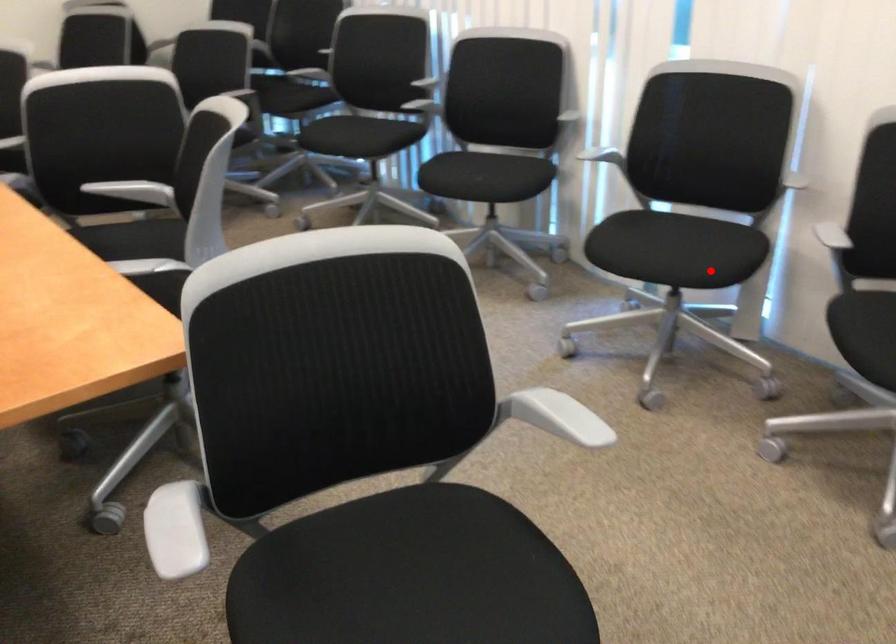
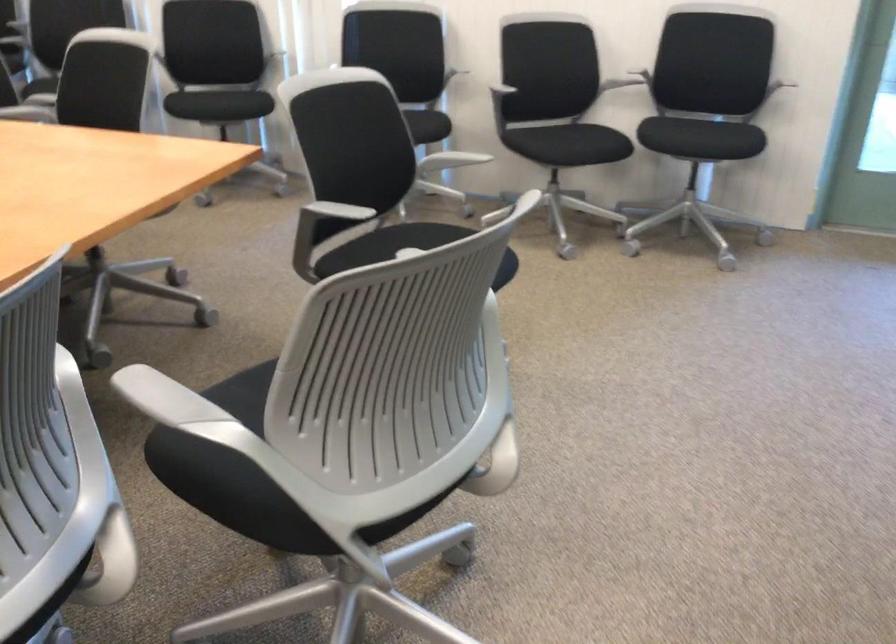
Find the pixel in the second image that matches the highlighted location in the first image.

(426, 126)